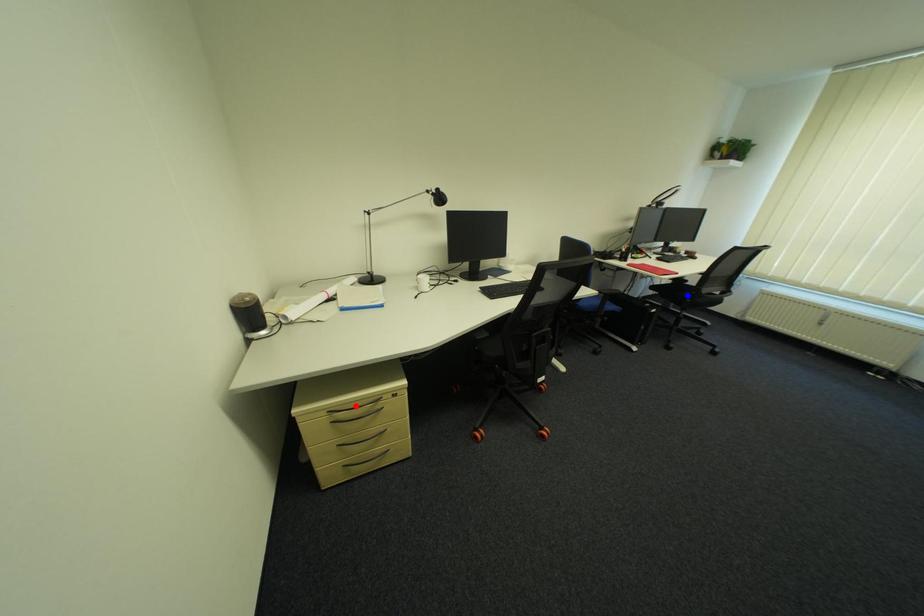
Question: Which of the two points in the image is closer to the camera?

Choices:
 (A) Blue point is closer.
 (B) Red point is closer.

Answer: (B)